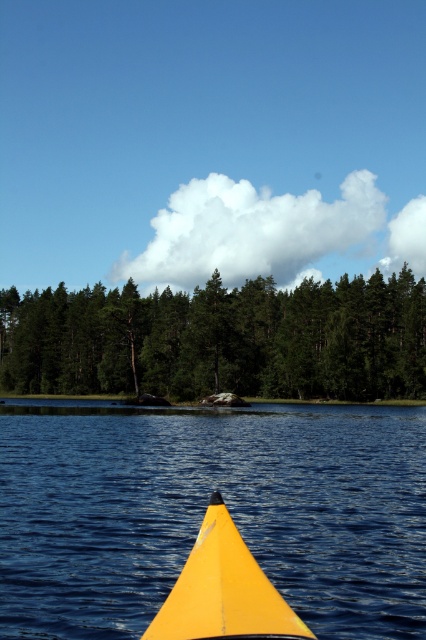
You are in a boat and looking at the yellow plastic water at lower center and the green matte trees at center. Which object is closer to you?

The yellow plastic water at lower center is closer to you because it is in front of the green matte trees at center.

You are in a boat and see the yellow plastic water at lower center and the green matte trees at center. Which object is narrower?

The yellow plastic water at lower center is thinner than the green matte trees at center, so the yellow plastic water at lower center is narrower.

You are in a kayak looking at the scene. There are two points marked on your map, point [339,408] and point [209,531]. Which point is closer to your current position?

Point [339,408] is further to the camera than point [209,531], so the point closer to your current position is point [209,531].